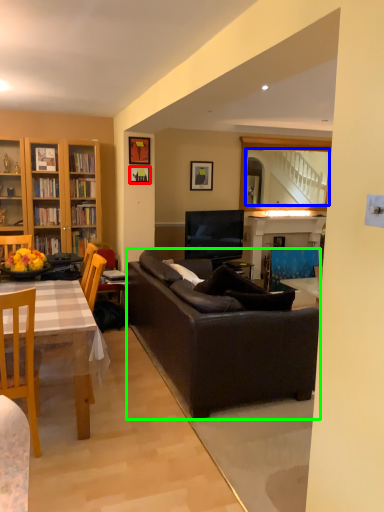
Question: Which is farther away from picture frame (highlighted by a red box)? mirror (highlighted by a blue box) or studio couch (highlighted by a green box)?

Choices:
 (A) mirror
 (B) studio couch

Answer: (A)